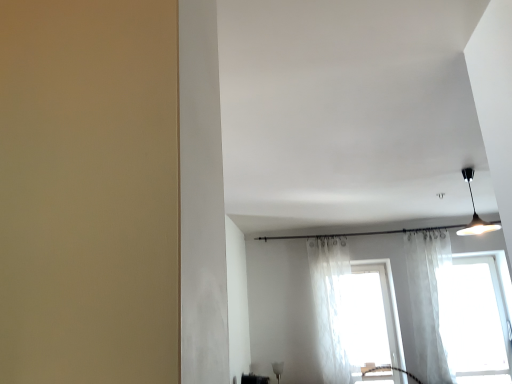
What do you see at coordinates (429, 300) in the screenshot? I see `white sheer curtain at right, which ranks as the 2th curtain in left-to-right order` at bounding box center [429, 300].

At what (x,y) coordinates should I click in order to perform the action: click on transparent fabric window at right, the 2th window from the left. Please return your answer as a coordinate pair (x, y). The image size is (512, 384). Looking at the image, I should click on (474, 318).

Describe the element at coordinates (475, 212) in the screenshot. I see `black matte pendant light at upper right` at that location.

The image size is (512, 384). I want to click on translucent fabric window at center, arranged as the second window when viewed from the right, so click(368, 319).

What is the approximate width of translucent fabric window at center, arranged as the second window when viewed from the right?

translucent fabric window at center, arranged as the second window when viewed from the right, is 30.86 centimeters wide.

The image size is (512, 384). What are the coordinates of `translucent white curtain at center, the second curtain positioned from the right` in the screenshot? It's located at (330, 305).

The width and height of the screenshot is (512, 384). Describe the element at coordinates (254, 379) in the screenshot. I see `black glossy shelf at lower center` at that location.

Identify the location of white sheer curtain at right, which ranks as the 2th curtain in left-to-right order. The image size is (512, 384). (429, 300).

Based on the photo, are black matte pendant light at upper right and translucent white curtain at center, the second curtain positioned from the right, located far from each other?

Yes, black matte pendant light at upper right and translucent white curtain at center, the second curtain positioned from the right, are quite far apart.

Is black matte pendant light at upper right looking in the opposite direction of translucent white curtain at center, the second curtain positioned from the right?

black matte pendant light at upper right is not turned away from translucent white curtain at center, the second curtain positioned from the right.

Which point is more distant from viewer, (493, 225) or (324, 363)?

The point (324, 363) is farther from the camera.

Locate an element on the screen. The image size is (512, 384). light fixture that appears in front of the translucent white curtain at center, the first curtain from the left is located at coordinates (475, 212).

Does transparent fabric window at right, the 2th window from the left, have a greater width compared to black glossy shelf at lower center?

Correct, the width of transparent fabric window at right, the 2th window from the left, exceeds that of black glossy shelf at lower center.

From a real-world perspective, who is located lower, transparent fabric window at right, arranged as the first window when viewed from the right, or black glossy shelf at lower center?

black glossy shelf at lower center is physically lower.

From a real-world perspective, between translucent white curtain at center, the first curtain from the left, and black glossy shelf at lower center, who is vertically lower?

From a 3D spatial view, black glossy shelf at lower center is below.

Is translucent white curtain at center, the first curtain from the left, positioned beyond the bounds of black glossy shelf at lower center?

translucent white curtain at center, the first curtain from the left, is positioned outside black glossy shelf at lower center.

Between translucent white curtain at center, the second curtain positioned from the right, and black glossy shelf at lower center, which one has less height?

black glossy shelf at lower center.

Considering the sizes of objects translucent white curtain at center, the second curtain positioned from the right, and black glossy shelf at lower center in the image provided, who is wider, translucent white curtain at center, the second curtain positioned from the right, or black glossy shelf at lower center?

Wider between the two is translucent white curtain at center, the second curtain positioned from the right.

Does black glossy shelf at lower center have a smaller size compared to transparent fabric window at right, the 2th window from the left?

Correct, black glossy shelf at lower center occupies less space than transparent fabric window at right, the 2th window from the left.

Considering the relative positions of black glossy shelf at lower center and transparent fabric window at right, arranged as the first window when viewed from the right, in the image provided, is black glossy shelf at lower center to the left or to the right of transparent fabric window at right, arranged as the first window when viewed from the right,?

black glossy shelf at lower center is positioned on transparent fabric window at right, arranged as the first window when viewed from the right,'s left side.

Who is taller, black glossy shelf at lower center or transparent fabric window at right, arranged as the first window when viewed from the right?

Standing taller between the two is transparent fabric window at right, arranged as the first window when viewed from the right.

From a real-world perspective, which window is the 1st one above the black glossy shelf at lower center? Please provide its 2D coordinates.

[(474, 318)]

From the image's perspective, which one is positioned lower, white sheer curtain at right, which ranks as the 2th curtain in left-to-right order, or transparent fabric window at right, the 2th window from the left?

From the image's view, transparent fabric window at right, the 2th window from the left, is below.

Looking at the image, does white sheer curtain at right, which ranks as the 2th curtain in left-to-right order, seem bigger or smaller compared to transparent fabric window at right, the 2th window from the left?

white sheer curtain at right, which ranks as the 2th curtain in left-to-right order, is smaller than transparent fabric window at right, the 2th window from the left.

Considering the relative positions of white sheer curtain at right, which ranks as the 2th curtain in left-to-right order, and transparent fabric window at right, arranged as the first window when viewed from the right, in the image provided, is white sheer curtain at right, which ranks as the 2th curtain in left-to-right order, to the right of transparent fabric window at right, arranged as the first window when viewed from the right, from the viewer's perspective?

No.

Consider the image. From a real-world perspective, is white sheer curtain at right, the 1th curtain when ordered from right to left, over transparent fabric window at right, the 2th window from the left?

Yes, from a real-world perspective, white sheer curtain at right, the 1th curtain when ordered from right to left, is over transparent fabric window at right, the 2th window from the left

Is black matte pendant light at upper right wider or thinner than translucent fabric window at center, arranged as the second window when viewed from the right?

In the image, black matte pendant light at upper right appears to be wider than translucent fabric window at center, arranged as the second window when viewed from the right.

Based on their sizes in the image, would you say black matte pendant light at upper right is bigger or smaller than translucent fabric window at center, placed as the 1th window when sorted from left to right?

Clearly, black matte pendant light at upper right is smaller in size than translucent fabric window at center, placed as the 1th window when sorted from left to right.

Can you confirm if black matte pendant light at upper right is positioned to the left of translucent fabric window at center, arranged as the second window when viewed from the right?

No, black matte pendant light at upper right is not to the left of translucent fabric window at center, arranged as the second window when viewed from the right.

Considering the relative sizes of black matte pendant light at upper right and transparent fabric window at right, the 2th window from the left, in the image provided, is black matte pendant light at upper right smaller than transparent fabric window at right, the 2th window from the left,?

Correct, black matte pendant light at upper right occupies less space than transparent fabric window at right, the 2th window from the left.

Considering the relative positions of black matte pendant light at upper right and transparent fabric window at right, the 2th window from the left, in the image provided, is black matte pendant light at upper right to the right of transparent fabric window at right, the 2th window from the left, from the viewer's perspective?

Incorrect, black matte pendant light at upper right is not on the right side of transparent fabric window at right, the 2th window from the left.

Locate an element on the screen. window on the right of black matte pendant light at upper right is located at coordinates (474, 318).

Could you measure the distance between black matte pendant light at upper right and transparent fabric window at right, arranged as the first window when viewed from the right?

They are 34.87 inches apart.

This screenshot has width=512, height=384. What are the coordinates of `light fixture on the right of translucent white curtain at center, the first curtain from the left` in the screenshot? It's located at click(x=475, y=212).

This screenshot has width=512, height=384. What are the coordinates of `furniture below the transparent fabric window at right, arranged as the first window when viewed from the right (from a real-world perspective)` in the screenshot? It's located at (254, 379).

When comparing their distances from black glossy shelf at lower center, does transparent fabric window at right, the 2th window from the left, or translucent fabric window at center, placed as the 1th window when sorted from left to right, seem further?

transparent fabric window at right, the 2th window from the left.

Looking at the image, which one is located closer to translucent white curtain at center, the second curtain positioned from the right, white sheer curtain at right, which ranks as the 2th curtain in left-to-right order, or black glossy shelf at lower center?

white sheer curtain at right, which ranks as the 2th curtain in left-to-right order.

Based on their spatial positions, is white sheer curtain at right, which ranks as the 2th curtain in left-to-right order, or transparent fabric window at right, the 2th window from the left, further from black matte pendant light at upper right?

transparent fabric window at right, the 2th window from the left, is positioned further to the anchor black matte pendant light at upper right.

Based on their spatial positions, is translucent fabric window at center, placed as the 1th window when sorted from left to right, or transparent fabric window at right, arranged as the first window when viewed from the right, closer to black matte pendant light at upper right?

The object closer to black matte pendant light at upper right is transparent fabric window at right, arranged as the first window when viewed from the right.

Estimate the real-world distances between objects in this image. Which object is further from transparent fabric window at right, the 2th window from the left, translucent fabric window at center, arranged as the second window when viewed from the right, or translucent white curtain at center, the second curtain positioned from the right?

The object further to transparent fabric window at right, the 2th window from the left, is translucent white curtain at center, the second curtain positioned from the right.

Estimate the real-world distances between objects in this image. Which object is closer to translucent fabric window at center, arranged as the second window when viewed from the right, black matte pendant light at upper right or white sheer curtain at right, which ranks as the 2th curtain in left-to-right order?

white sheer curtain at right, which ranks as the 2th curtain in left-to-right order, is closer to translucent fabric window at center, arranged as the second window when viewed from the right.

Which object lies further to the anchor point translucent fabric window at center, placed as the 1th window when sorted from left to right, translucent white curtain at center, the second curtain positioned from the right, or black glossy shelf at lower center?

Based on the image, black glossy shelf at lower center appears to be further to translucent fabric window at center, placed as the 1th window when sorted from left to right.

Which object lies further to the anchor point black glossy shelf at lower center, white sheer curtain at right, which ranks as the 2th curtain in left-to-right order, or translucent white curtain at center, the second curtain positioned from the right?

Among the two, white sheer curtain at right, which ranks as the 2th curtain in left-to-right order, is located further to black glossy shelf at lower center.

Identify the location of window between black matte pendant light at upper right and translucent fabric window at center, placed as the 1th window when sorted from left to right, from front to back. (474, 318).

The height and width of the screenshot is (384, 512). I want to click on curtain located between translucent white curtain at center, the first curtain from the left, and transparent fabric window at right, arranged as the first window when viewed from the right, in the left-right direction, so click(x=429, y=300).

You are a GUI agent. You are given a task and a screenshot of the screen. Output one action in this format:
    pyautogui.click(x=<x>, y=<y>)
    Task: Click on the curtain between black glossy shelf at lower center and translucent fabric window at center, arranged as the second window when viewed from the right, in the horizontal direction
    The image size is (512, 384).
    Given the screenshot: What is the action you would take?
    pyautogui.click(x=330, y=305)

Find the location of `window between black glossy shelf at lower center and white sheer curtain at right, which ranks as the 2th curtain in left-to-right order, in the horizontal direction`. window between black glossy shelf at lower center and white sheer curtain at right, which ranks as the 2th curtain in left-to-right order, in the horizontal direction is located at coordinates (368, 319).